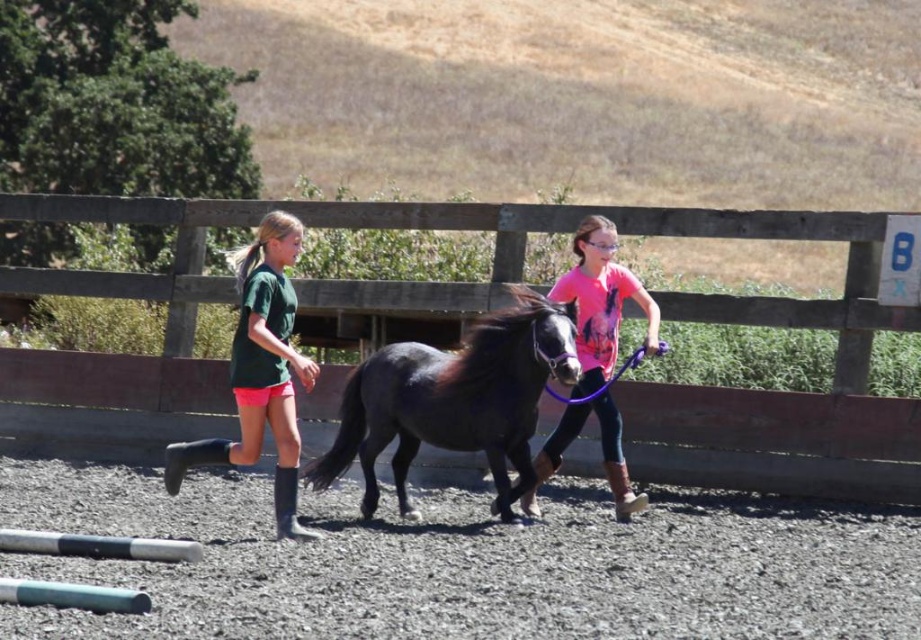
You are a photographer standing behind the fence and want to take a photo of the shiny black horse at center without the pink fabric shirt at center appearing in the shot. Is this possible given their current positions?

The shiny black horse at center is in front of the pink fabric shirt at center, so the horse will block the view of the shirt. Therefore, you can take a photo of the shiny black horse at center without the pink fabric shirt at center appearing in the shot.

You are standing at the point labeled as point (x=453, y=401). What do you see in front of you?

You see a shiny black horse at center in front of you.